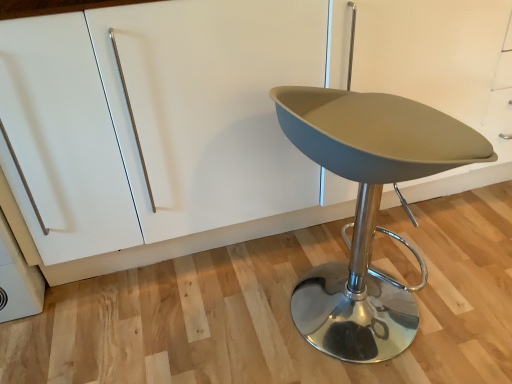
Question: In the image, is white matte cabinet at center positioned in front of or behind matte gray stool at center?

Choices:
 (A) behind
 (B) front

Answer: (A)

Question: Is point (179, 241) closer or farther from the camera than point (455, 122)?

Choices:
 (A) farther
 (B) closer

Answer: (A)

Question: From the image's perspective, relative to matte gray stool at center, is white matte cabinet at center above or below?

Choices:
 (A) above
 (B) below

Answer: (A)

Question: From a real-world perspective, is matte gray stool at center physically located above or below white matte cabinet at center?

Choices:
 (A) above
 (B) below

Answer: (B)

Question: Does point (308, 304) appear closer or farther from the camera than point (437, 102)?

Choices:
 (A) farther
 (B) closer

Answer: (A)

Question: From the image's perspective, relative to white matte cabinet at center, is matte gray stool at center above or below?

Choices:
 (A) above
 (B) below

Answer: (B)

Question: In terms of size, does matte gray stool at center appear bigger or smaller than white matte cabinet at center?

Choices:
 (A) big
 (B) small

Answer: (B)